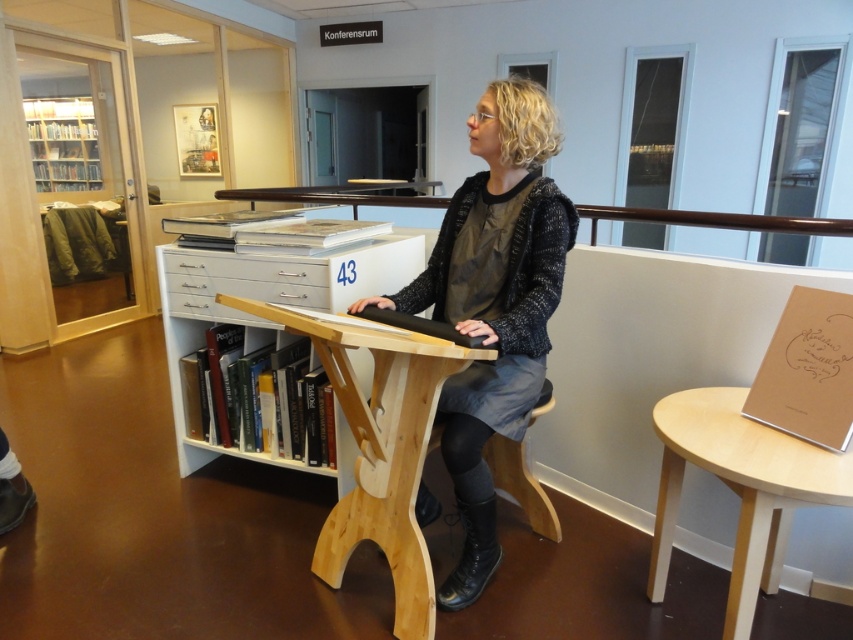
Question: Which point is closer to the camera?

Choices:
 (A) (577, 218)
 (B) (204, 276)
 (C) (32, 161)
 (D) (193, 308)

Answer: (A)

Question: Can you confirm if wooden bookshelf at upper left is positioned above light wood stool at center?

Choices:
 (A) yes
 (B) no

Answer: (A)

Question: Can you confirm if matte black sweater at center is positioned above wooden bookshelf at upper left?

Choices:
 (A) no
 (B) yes

Answer: (A)

Question: Which of the following is the farthest from the observer?

Choices:
 (A) wooden bookshelf at upper left
 (B) light wood stool at center
 (C) light wood round table at lower right

Answer: (A)

Question: Which of the following is the closest to the observer?

Choices:
 (A) (373, 435)
 (B) (515, 497)
 (C) (483, 125)

Answer: (A)

Question: In this image, where is matte black sweater at center located relative to light wood round table at lower right?

Choices:
 (A) above
 (B) below

Answer: (A)